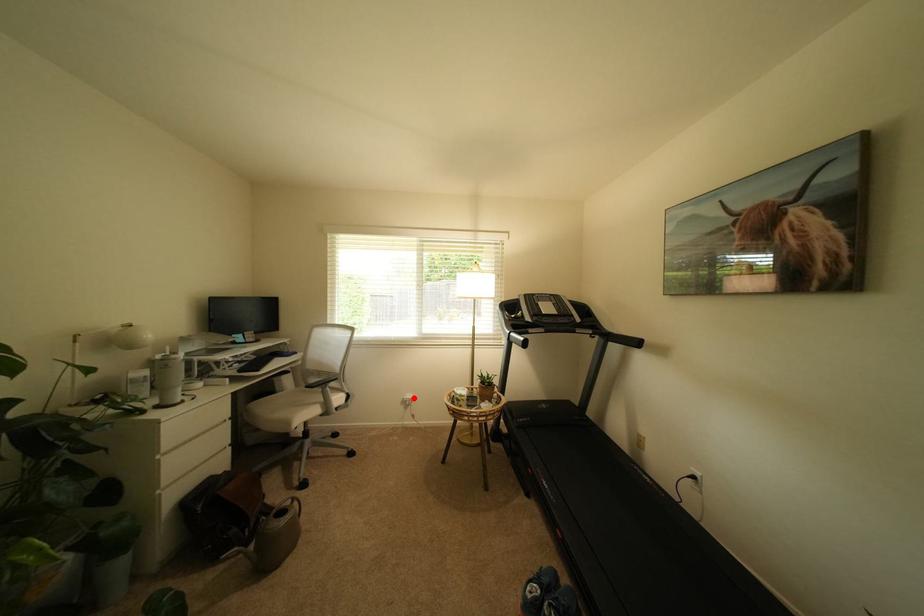
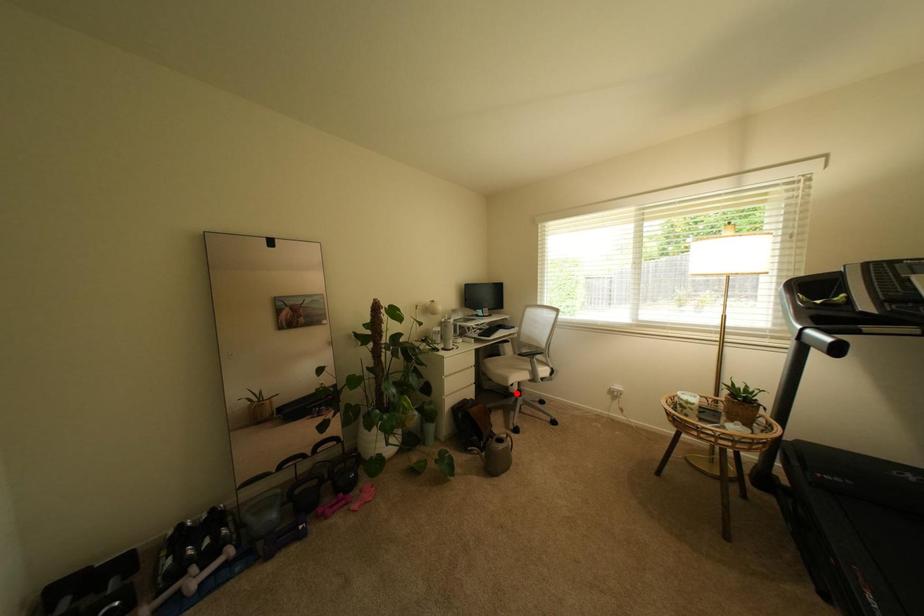
I am providing you with two images of the same scene from different viewpoints. A red point is marked on the first image and another point is marked on the second image. Does the point marked in image1 correspond to the same location as the one in image2?

No